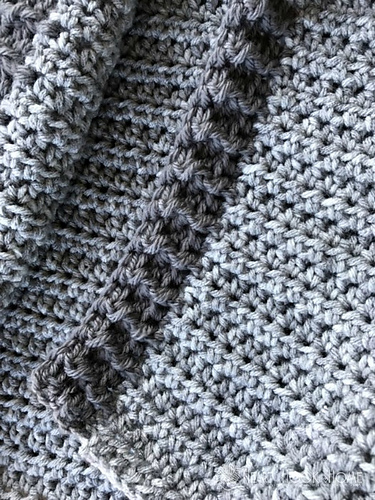
Locate an element on the screen. blanket or sweater is located at coordinates (110, 215).